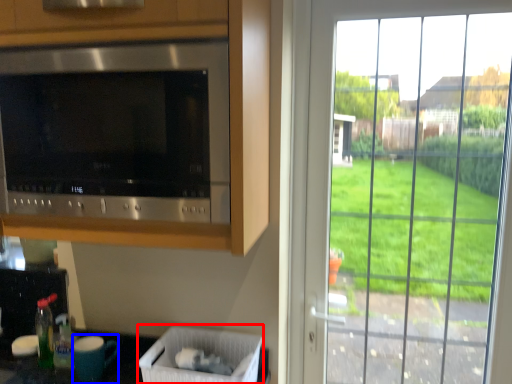
Question: Which object is further to the camera taking this photo, laundry basket (highlighted by a red box) or appliance (highlighted by a blue box)?

Choices:
 (A) laundry basket
 (B) appliance

Answer: (B)